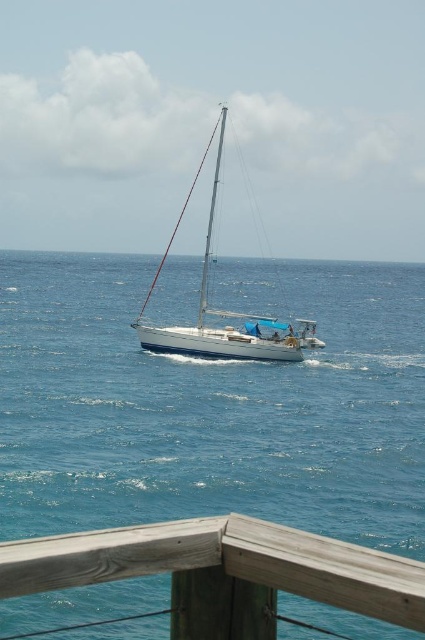
Question: Which of the following is the farthest from the observer?

Choices:
 (A) (422, 586)
 (B) (424, 340)
 (C) (244, 353)

Answer: (B)

Question: Which point is farther from the camera taking this photo?

Choices:
 (A) (198, 300)
 (B) (212, 637)

Answer: (A)

Question: Which point is closer to the camera?

Choices:
 (A) (229, 481)
 (B) (294, 349)
 (C) (6, 563)

Answer: (C)

Question: Is wooden at lower left further to camera compared to white glossy sailboat at center?

Choices:
 (A) no
 (B) yes

Answer: (A)

Question: From the image, what is the correct spatial relationship of wooden at lower left in relation to white glossy sailboat at center?

Choices:
 (A) below
 (B) above

Answer: (A)

Question: Where is blue water at center located in relation to white glossy sailboat at center in the image?

Choices:
 (A) right
 (B) left

Answer: (B)